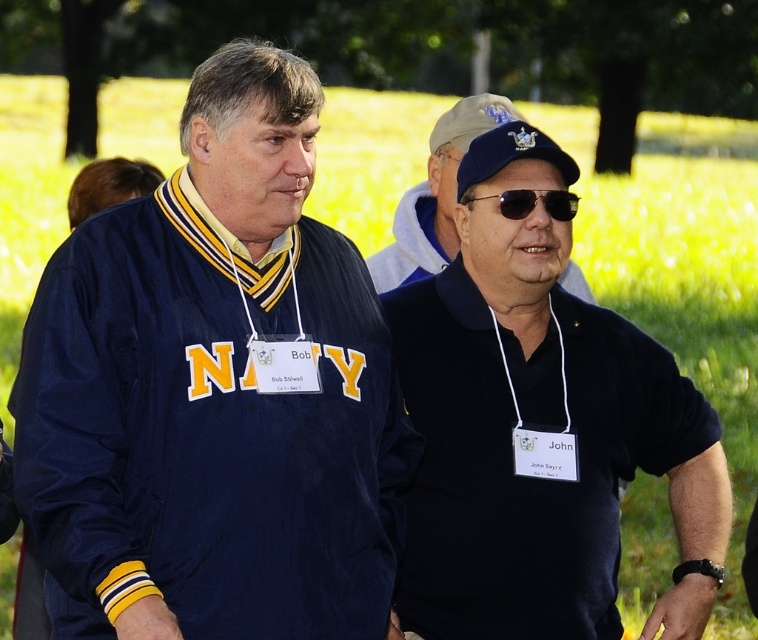
Between blue fabric baseball cap at center and black reflective sunglasses at center, which one has more height?

blue fabric baseball cap at center is taller.

Which is in front, point (500, 166) or point (569, 202)?

Point (500, 166)

Find the location of a particular element. The image size is (758, 640). blue fabric baseball cap at center is located at coordinates click(509, 154).

Between black matte shirt at right and black matte cap at upper center, which one has less height?

Standing shorter between the two is black matte cap at upper center.

Is black matte shirt at right closer to the viewer compared to black matte cap at upper center?

Yes, it is.

Identify the location of black matte shirt at right. This screenshot has height=640, width=758. (540, 429).

This screenshot has height=640, width=758. Find the location of `black matte shirt at right`. black matte shirt at right is located at coordinates (540, 429).

Is black matte cap at upper center to the left of black reflective sunglasses at center from the viewer's perspective?

Correct, you'll find black matte cap at upper center to the left of black reflective sunglasses at center.

Which is more to the right, black matte cap at upper center or black reflective sunglasses at center?

black reflective sunglasses at center is more to the right.

Measure the distance between black matte cap at upper center and camera.

A distance of 6.04 meters exists between black matte cap at upper center and camera.

Locate an element on the screen. Image resolution: width=758 pixels, height=640 pixels. black matte cap at upper center is located at coordinates (434, 195).